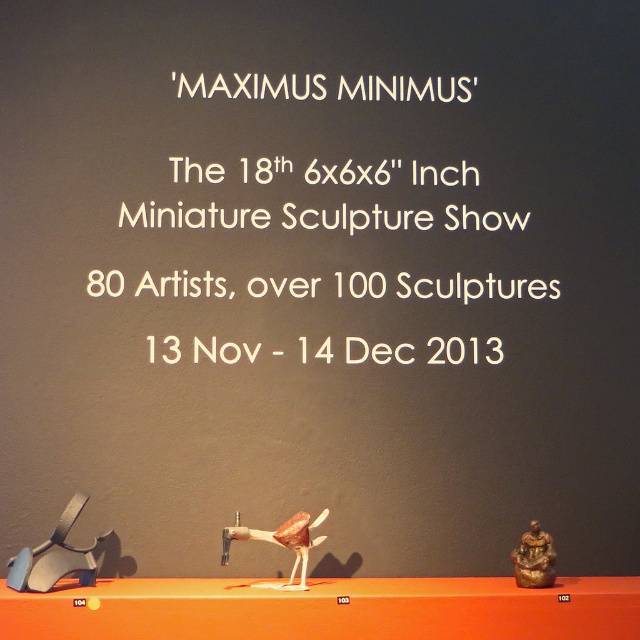
Can you confirm if matte black chair at lower left is bigger than metallic red bird at center?

Indeed, matte black chair at lower left has a larger size compared to metallic red bird at center.

Is point (38, 566) farther from viewer compared to point (284, 522)?

That is False.

Who is more distant from viewer, (19, 560) or (276, 529)?

Point (276, 529)

The width and height of the screenshot is (640, 640). I want to click on matte black chair at lower left, so click(54, 556).

Who is higher up, white paper at center or metallic red bird at center?

white paper at center is higher up.

Does point (291, 276) come in front of point (326, 509)?

That is False.

Is point (378, 352) farther from viewer compared to point (228, 540)?

That is True.

This screenshot has height=640, width=640. I want to click on white paper at center, so click(x=317, y=196).

Can you confirm if white paper at center is thinner than bronze statue at right?

Incorrect, white paper at center's width is not less than bronze statue at right's.

Does white paper at center have a lesser height compared to bronze statue at right?

No.

Is point (404, 88) closer to camera compared to point (532, 576)?

No.

Identify the location of white paper at center. The width and height of the screenshot is (640, 640). (317, 196).